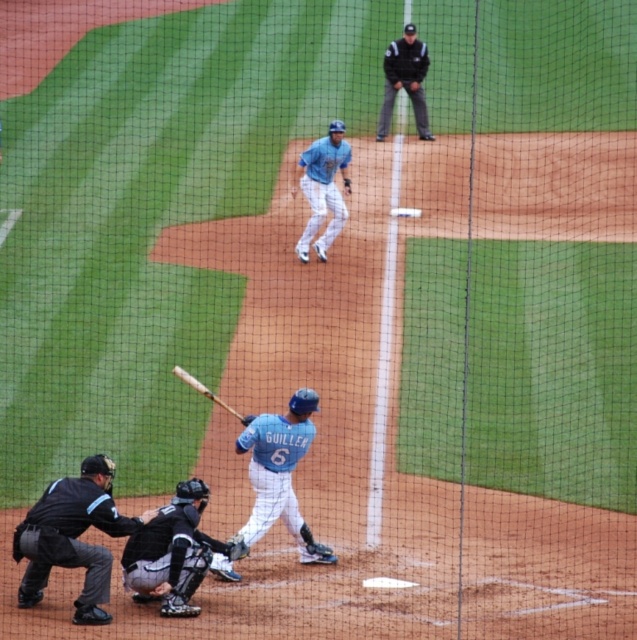
In the scene shown: Does black leather catcher at lower left appear on the right side of wooden baseball bat at center?

No, black leather catcher at lower left is not to the right of wooden baseball bat at center.

Who is positioned more to the left, black leather catcher at lower left or wooden baseball bat at center?

black leather catcher at lower left is more to the left.

Is point (161, 595) more distant than point (248, 419)?

No, it is not.

Find the location of a particular element. black leather catcher at lower left is located at coordinates (171, 552).

Is black leather umpire at lower left wider than dark brown leather glove at lower center?

Yes.

Consider the image. Which of these two, black leather umpire at lower left or dark brown leather glove at lower center, stands taller?

Standing taller between the two is black leather umpire at lower left.

What do you see at coordinates (73, 536) in the screenshot? I see `black leather umpire at lower left` at bounding box center [73, 536].

Identify the location of black leather umpire at lower left. The height and width of the screenshot is (640, 637). (73, 536).

Is black leather catcher at lower left bigger than light blue jersey at upper center?

No, black leather catcher at lower left is not bigger than light blue jersey at upper center.

Which of these two, black leather catcher at lower left or light blue jersey at upper center, stands taller?

light blue jersey at upper center is taller.

Who is more distant from viewer, [166,600] or [326,145]?

Positioned behind is point [326,145].

This screenshot has width=637, height=640. What are the coordinates of `black leather catcher at lower left` in the screenshot? It's located at (171, 552).